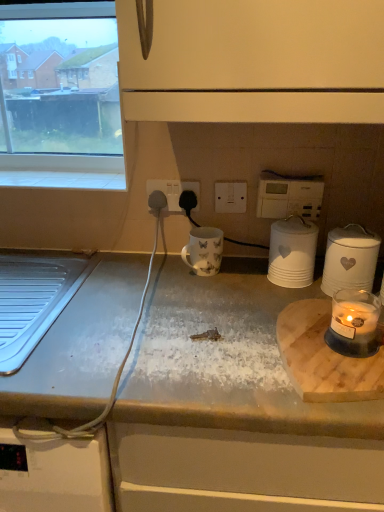
The image size is (384, 512). What are the coordinates of `free spot to the left of translucent glass candle at right` in the screenshot? It's located at (229, 350).